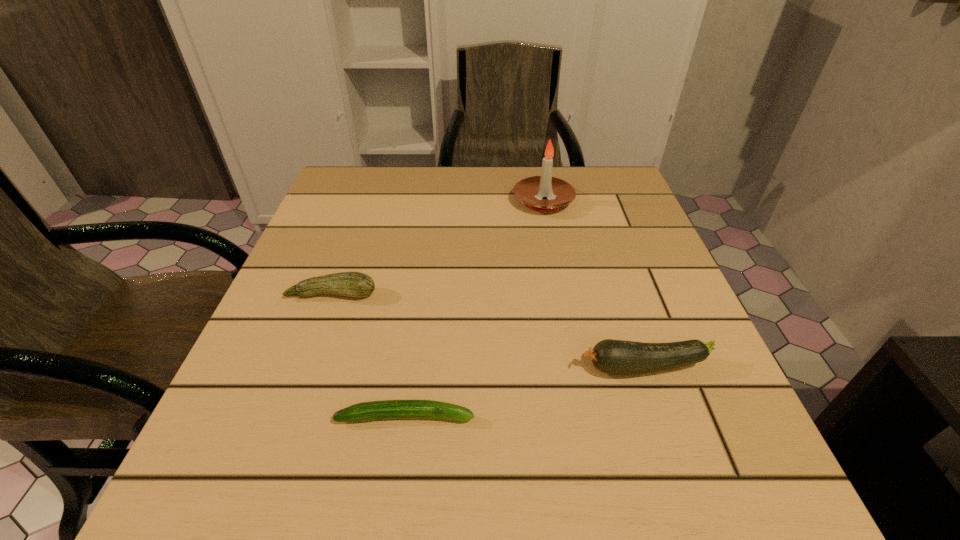
Image resolution: width=960 pixels, height=540 pixels. Find the location of `the tallest object`. the tallest object is located at coordinates (531, 191).

Where is `candle`? This screenshot has width=960, height=540. candle is located at coordinates (531, 191).

Find the location of a particular element. This screenshot has height=540, width=960. the second nearest object is located at coordinates (615, 357).

At what (x,y) coordinates should I click in order to perform the action: click on the rightmost zucchini. Please return your answer as a coordinate pair (x, y). Looking at the image, I should click on (615, 357).

You are a GUI agent. You are given a task and a screenshot of the screen. Output one action in this format:
    pyautogui.click(x=<x>, y=<y>)
    Task: Click on the farthest zucchini
    
    Given the screenshot: What is the action you would take?
    pyautogui.click(x=351, y=284)

Locate an element on the screen. The height and width of the screenshot is (540, 960). the second shortest zucchini is located at coordinates (351, 284).

In order to click on the shortest zucchini in this screenshot , I will do `click(387, 409)`.

Find the location of a particular element. This screenshot has height=540, width=960. the nearest object is located at coordinates (387, 409).

At what (x,y) coordinates should I click in order to perform the action: click on free location located on the back of the candle. Please return your answer as a coordinate pair (x, y). Looking at the image, I should click on (537, 166).

Locate an element on the screen. The height and width of the screenshot is (540, 960). free space located 0.220m at the blossom end of the second nearest zucchini is located at coordinates (438, 368).